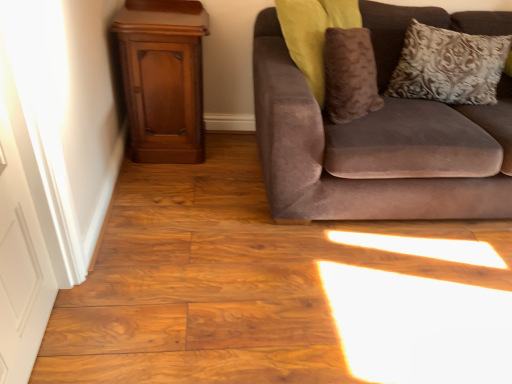
The height and width of the screenshot is (384, 512). What are the coordinates of `free area in between mahogany wood dresser at left and suede couch at right` in the screenshot? It's located at click(x=209, y=180).